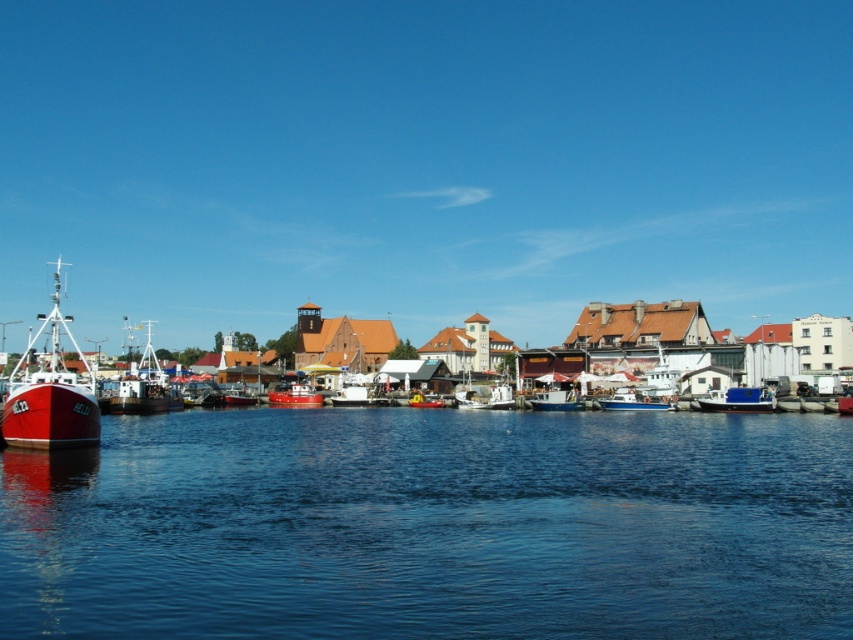
Who is more forward, (270, 403) or (554, 394)?

Point (554, 394) is more forward.

Who is taller, red rubber boat at center or white plastic boat at center?

Standing taller between the two is red rubber boat at center.

I want to click on red rubber boat at center, so click(294, 396).

This screenshot has height=640, width=853. What do you see at coordinates (432, 525) in the screenshot?
I see `blue liquid water at lower center` at bounding box center [432, 525].

Can you confirm if blue liquid water at lower center is positioned above yellow rubber dinghy at center?

Actually, blue liquid water at lower center is below yellow rubber dinghy at center.

You are a GUI agent. You are given a task and a screenshot of the screen. Output one action in this format:
    pyautogui.click(x=<x>, y=<y>)
    Task: Click on the blue liquid water at lower center
    
    Given the screenshot: What is the action you would take?
    pyautogui.click(x=432, y=525)

Between blue matte boat at right and white matte boat at center, which one appears on the right side from the viewer's perspective?

blue matte boat at right is more to the right.

Is blue matte boat at right positioned before white matte boat at center?

Yes, it is in front of white matte boat at center.

Is point (706, 396) positioned before point (349, 397)?

Yes, it is.

What are the coordinates of `blue matte boat at right` in the screenshot? It's located at (740, 400).